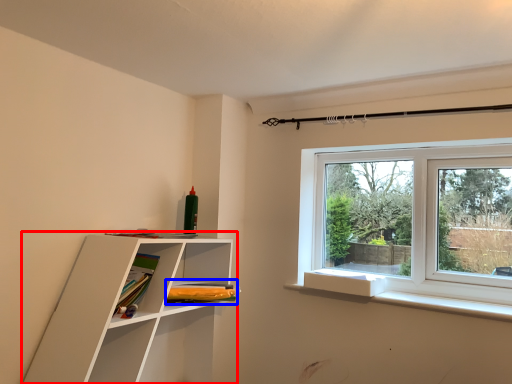
Question: Among these objects, which one is farthest to the camera, shelf (highlighted by a red box) or book (highlighted by a blue box)?

Choices:
 (A) shelf
 (B) book

Answer: (B)